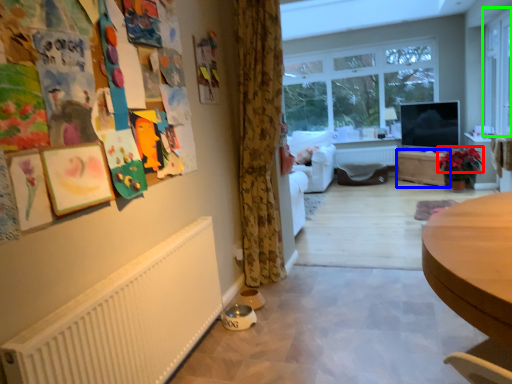
Question: Estimate the real-world distances between objects in this image. Which object is closer to flower (highlighted by a red box), table (highlighted by a blue box) or window (highlighted by a green box)?

Choices:
 (A) table
 (B) window

Answer: (A)